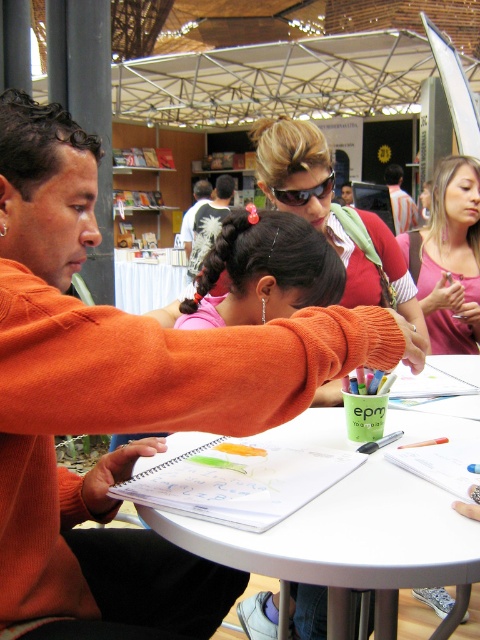
In the scene shown: Who is more forward, (392, 188) or (187, 232)?

Point (187, 232)

Can you confirm if striped shirt at upper right is bigger than white printed t-shirt at center?

Yes.

Is point (400, 227) farther from viewer compared to point (191, 234)?

Yes, point (400, 227) is farther from viewer.

Locate an element on the screen. This screenshot has height=640, width=480. striped shirt at upper right is located at coordinates (399, 200).

In the scene shown: Can you confirm if white plastic table at center is bigger than white printed t-shirt at center?

Actually, white plastic table at center might be smaller than white printed t-shirt at center.

Can you confirm if white plastic table at center is positioned to the left of white printed t-shirt at center?

No, white plastic table at center is not to the left of white printed t-shirt at center.

Find the location of a particular element. This screenshot has width=480, height=640. white plastic table at center is located at coordinates (349, 536).

Consider the image. Which of these two, white feathered shirt at center or striped shirt at upper right, stands shorter?

striped shirt at upper right is shorter.

Can you confirm if white feathered shirt at center is bigger than striped shirt at upper right?

Yes.

The height and width of the screenshot is (640, 480). I want to click on white feathered shirt at center, so click(x=210, y=221).

This screenshot has height=640, width=480. Identify the location of white feathered shirt at center. (210, 221).